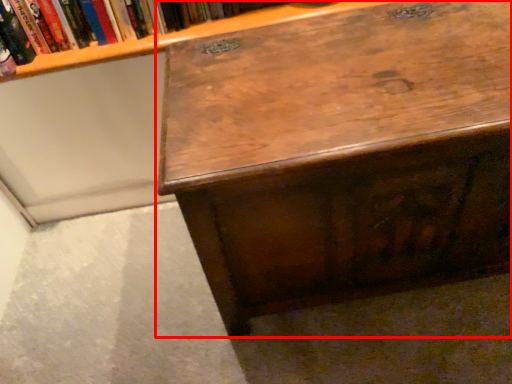
Question: Observing the image, what is the correct spatial positioning of desk (annotated by the red box) in reference to book?

Choices:
 (A) right
 (B) left

Answer: (A)